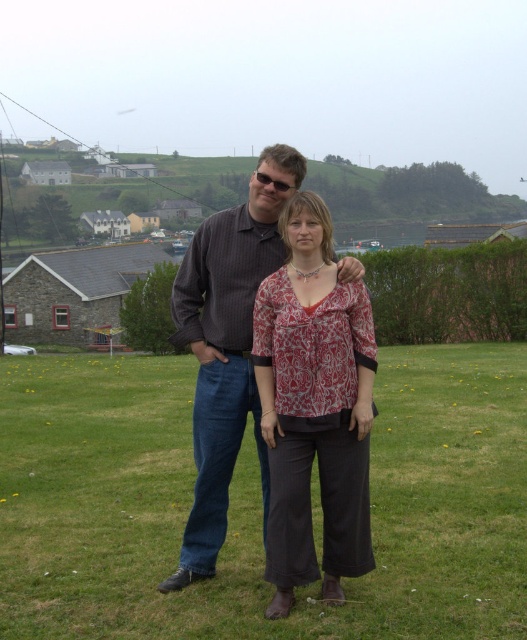
Is patterned fabric blouse at center above dark brown striped shirt at center?

Incorrect, patterned fabric blouse at center is not positioned above dark brown striped shirt at center.

Which is behind, point (290, 300) or point (253, 273)?

The point (253, 273) is behind.

Is point (295, 484) farther from camera compared to point (220, 500)?

No, it is in front of (220, 500).

You are a GUI agent. You are given a task and a screenshot of the screen. Output one action in this format:
    pyautogui.click(x=<x>, y=<y>)
    Task: Click on the patterned fabric blouse at center
    The width and height of the screenshot is (527, 640).
    Given the screenshot: What is the action you would take?
    pyautogui.click(x=314, y=408)

Who is higher up, green grass at center or patterned fabric blouse at center?

Positioned higher is patterned fabric blouse at center.

Who is taller, green grass at center or patterned fabric blouse at center?

With more height is patterned fabric blouse at center.

This screenshot has width=527, height=640. Find the location of `green grass at center`. green grass at center is located at coordinates (258, 502).

Can you confirm if green grass at center is taller than dark brown striped shirt at center?

Incorrect, green grass at center's height is not larger of dark brown striped shirt at center's.

Consider the image. Is green grass at center bigger than dark brown striped shirt at center?

Incorrect, green grass at center is not larger than dark brown striped shirt at center.

Image resolution: width=527 pixels, height=640 pixels. Find the location of `green grass at center`. green grass at center is located at coordinates (258, 502).